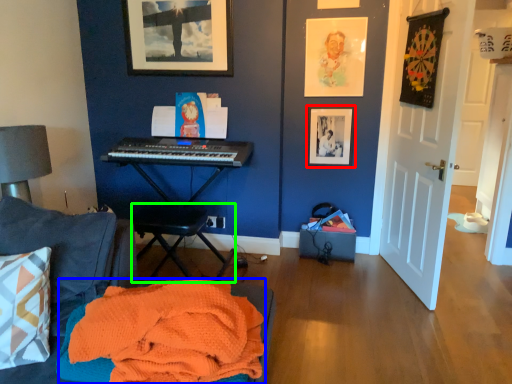
Question: Which object is the farthest from picture frame (highlighted by a red box)? Choose among these: blanket (highlighted by a blue box) or music stool (highlighted by a green box).

Choices:
 (A) blanket
 (B) music stool

Answer: (A)